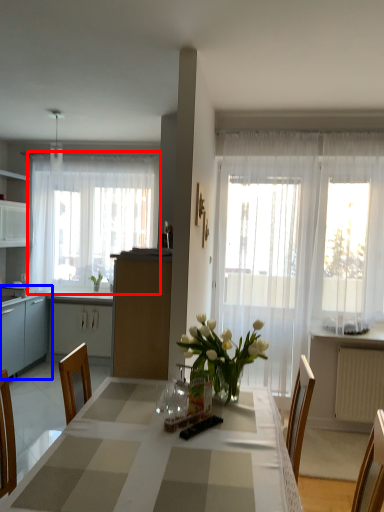
Question: Which object appears farthest to the camera in this image, curtain (highlighted by a red box) or cabinetry (highlighted by a blue box)?

Choices:
 (A) curtain
 (B) cabinetry

Answer: (A)